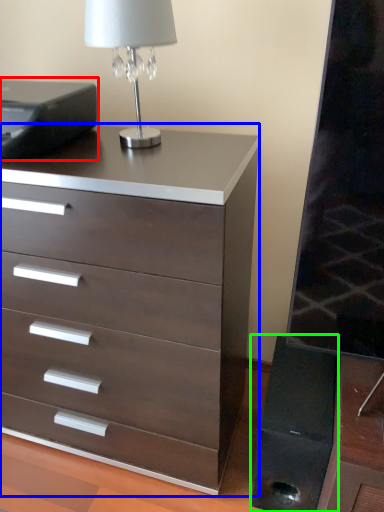
Question: Which is farther away from printer (highlighted by a red box)? chest of drawers (highlighted by a blue box) or speaker (highlighted by a green box)?

Choices:
 (A) chest of drawers
 (B) speaker

Answer: (B)